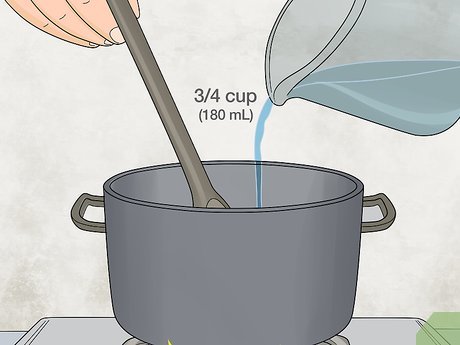
Where is `pot`? pot is located at coordinates (176, 243).